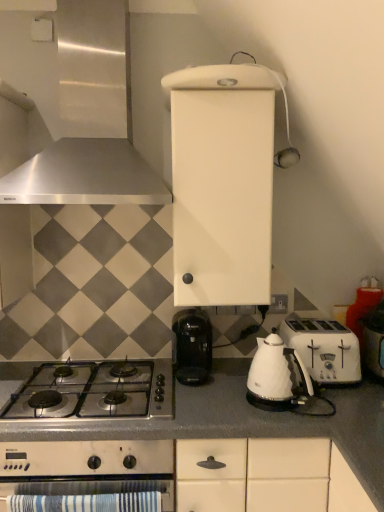
I want to click on free spot below white glossy kettle at lower center (from a real-world perspective), so click(x=274, y=407).